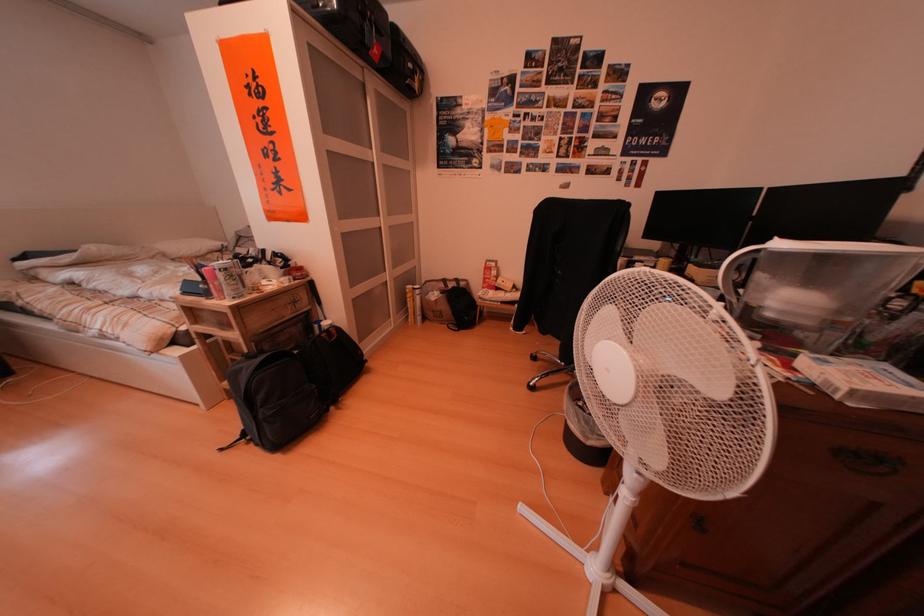
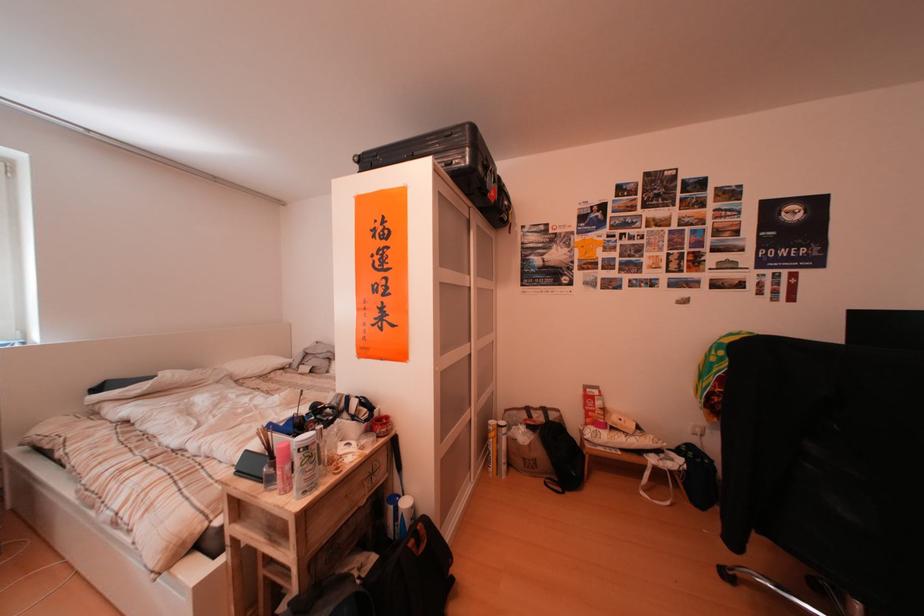
Locate, in the second image, the point that corresponds to pixel 332 331 in the first image.

(408, 515)